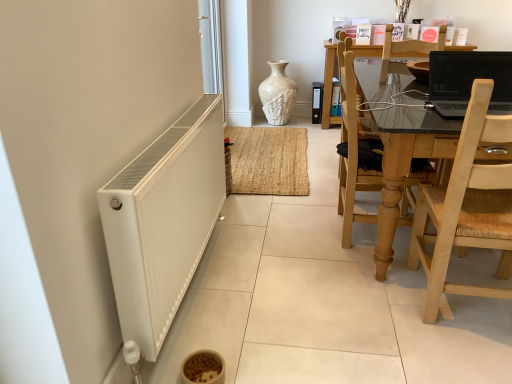
Find the location of `vacant region to the left of light wood woven seat at right, which appears as the first chair when viewed from the front`. vacant region to the left of light wood woven seat at right, which appears as the first chair when viewed from the front is located at coordinates (374, 306).